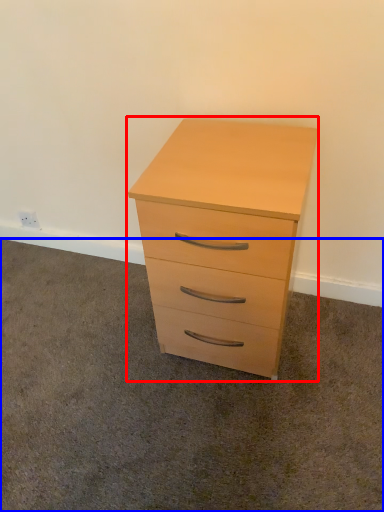
Question: Which object is closer to the camera taking this photo, chest of drawers (highlighted by a red box) or plain (highlighted by a blue box)?

Choices:
 (A) chest of drawers
 (B) plain

Answer: (B)